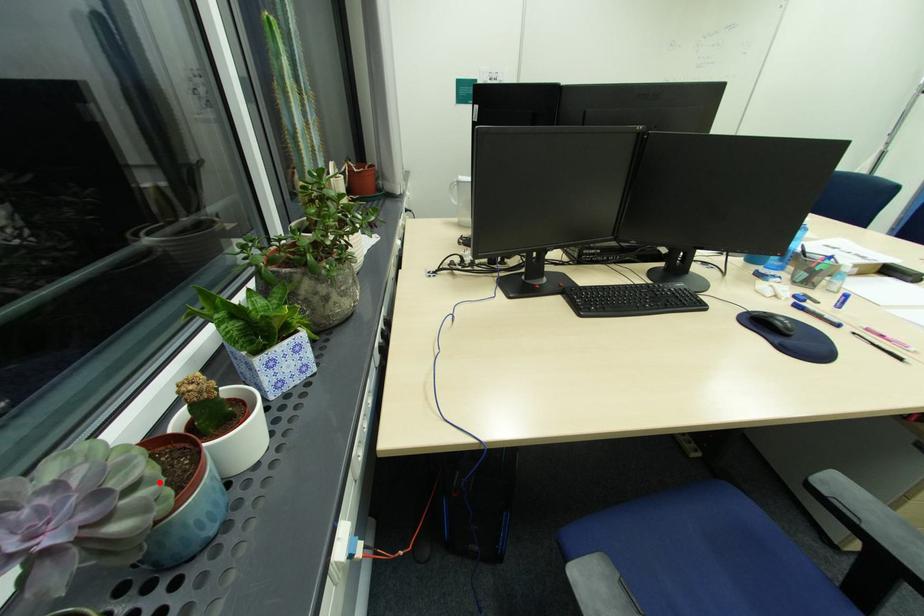
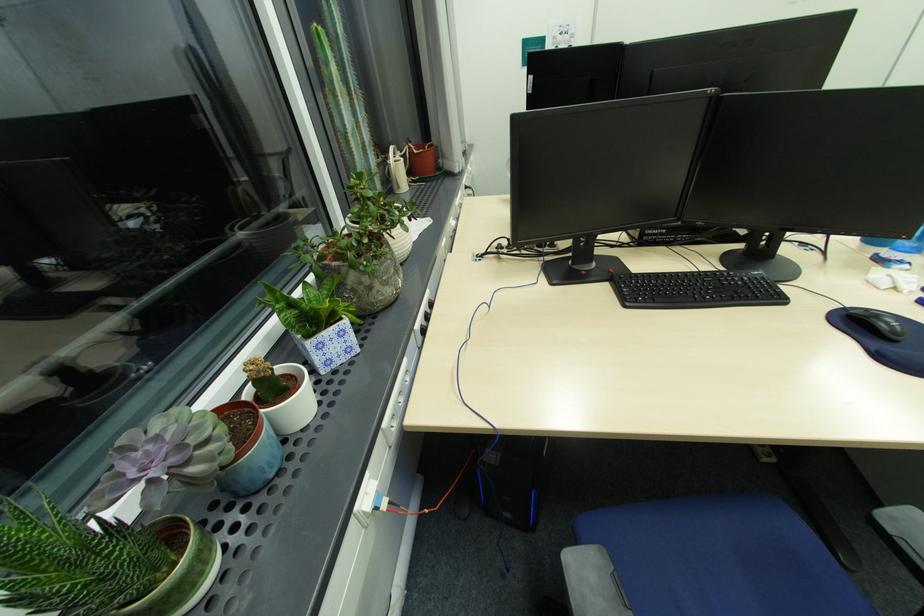
In the second image, find the point that corresponds to the highlighted location in the first image.

(225, 440)